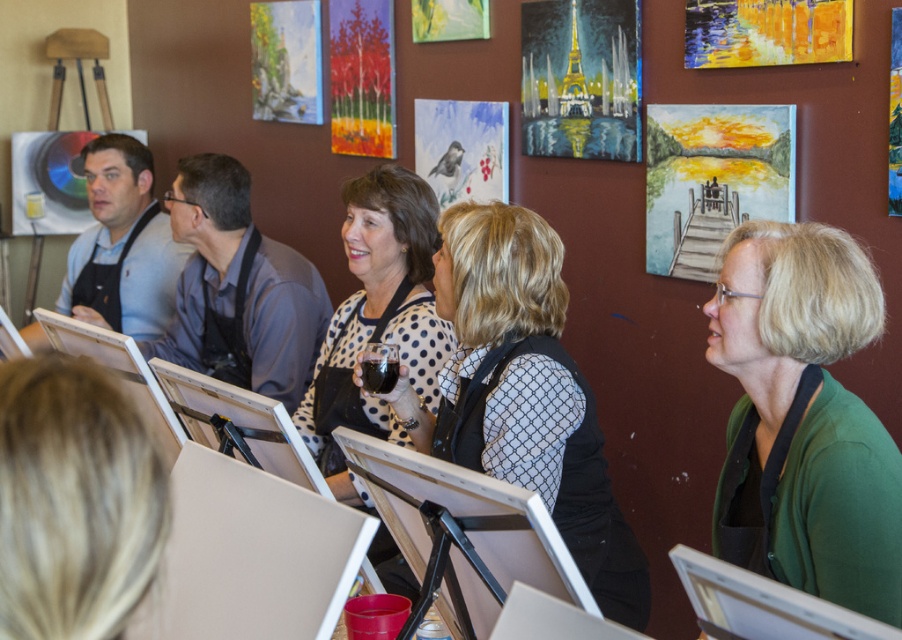
Question: Which object is farther from the camera taking this photo?

Choices:
 (A) polka dot blouse at center
 (B) yellow acrylic painting at upper right
 (C) red acrylic painting at center
 (D) shiny gold tower at upper center

Answer: (C)

Question: Which object appears farthest from the camera in this image?

Choices:
 (A) red acrylic painting at center
 (B) matte paper bird on the right

Answer: (A)

Question: In this image, where is polka dot blouse at center located relative to pastel oil painting of trees at upper center?

Choices:
 (A) left
 (B) right

Answer: (B)

Question: Which point is farther from the camera taking this photo?

Choices:
 (A) (849, 19)
 (B) (359, 6)
 (C) (422, 8)

Answer: (B)

Question: Observing the image, what is the correct spatial positioning of polka dot blouse at center in reference to pastel oil painting of trees at upper center?

Choices:
 (A) right
 (B) left

Answer: (A)

Question: Considering the relative positions of red acrylic painting at center and pastel oil painting of trees at upper center in the image provided, where is red acrylic painting at center located with respect to pastel oil painting of trees at upper center?

Choices:
 (A) left
 (B) right

Answer: (A)